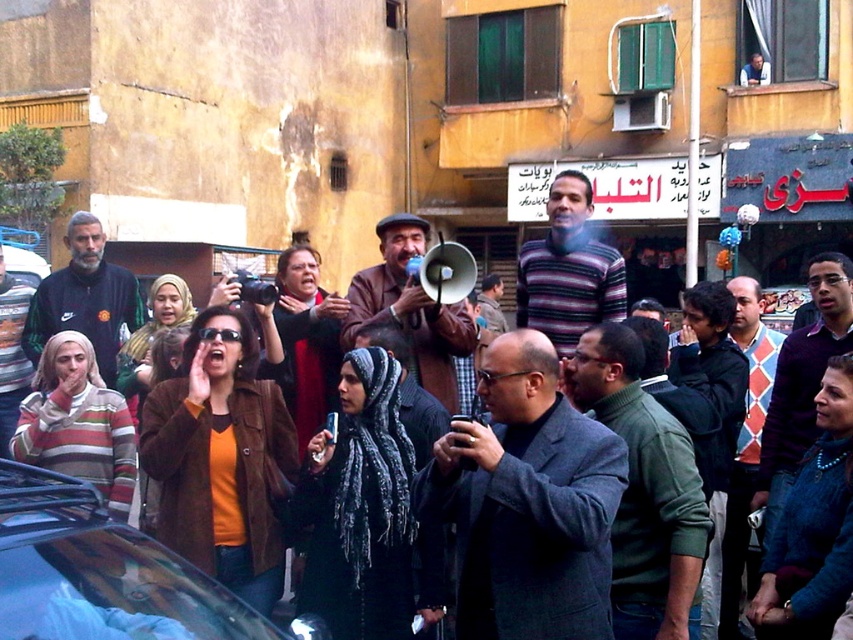
You are a photographer standing at the point marked as point (85, 298) in the image. You want to capture a photo of the black nike tracksuit at left. Is the black nike tracksuit at left within your current field of view?

The point (85, 298) corresponds to the black nike tracksuit at left, so yes, the black nike tracksuit at left is within your current field of view as you are standing at that point.

Based on the photo, you are standing at the point with coordinates point (x=727, y=365) and want to walk towards the point with coordinates point (x=602, y=396). Which direction should you move to reach your destination?

You should move forward because point (x=602, y=396) is in front of point (x=727, y=365).